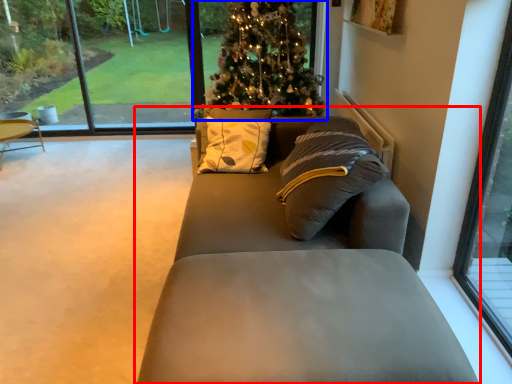
Question: Which object is closer to the camera taking this photo, studio couch (highlighted by a red box) or christmas tree (highlighted by a blue box)?

Choices:
 (A) studio couch
 (B) christmas tree

Answer: (A)